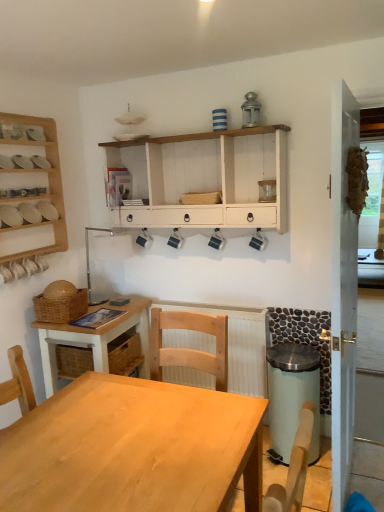
Question: Is white painted wood shelf at upper center, arranged as the 1th shelf when viewed from the right, at the right side of natural wood desk at left?

Choices:
 (A) yes
 (B) no

Answer: (A)

Question: Does white painted wood shelf at upper center, arranged as the 1th shelf when viewed from the right, turn towards natural wood desk at left?

Choices:
 (A) no
 (B) yes

Answer: (A)

Question: Is white painted wood shelf at upper center, the 2th shelf from the left, smaller than natural wood desk at left?

Choices:
 (A) no
 (B) yes

Answer: (B)

Question: From the image's perspective, does white painted wood shelf at upper center, the 2th shelf from the left, appear lower than natural wood desk at left?

Choices:
 (A) yes
 (B) no

Answer: (B)

Question: Is natural wood desk at left inside white painted wood shelf at upper center, the 2th shelf from the left?

Choices:
 (A) no
 (B) yes

Answer: (A)

Question: Is white painted wood shelf at upper center, the 2th shelf from the left, in front of or behind wooden shelf at left in the image?

Choices:
 (A) front
 (B) behind

Answer: (B)

Question: Is white painted wood shelf at upper center, the 2th shelf from the left, bigger or smaller than wooden shelf at left?

Choices:
 (A) small
 (B) big

Answer: (B)

Question: Choose the correct answer: Is white painted wood shelf at upper center, the 2th shelf from the left, inside wooden shelf at left or outside it?

Choices:
 (A) inside
 (B) outside

Answer: (B)

Question: Based on their positions, is white painted wood shelf at upper center, the 2th shelf from the left, located to the left or right of wooden shelf at left?

Choices:
 (A) left
 (B) right

Answer: (B)

Question: From a real-world perspective, relative to natural wood desk at left, is white matte bowls at upper left, the second shelf positioned from the right, vertically above or below?

Choices:
 (A) below
 (B) above

Answer: (B)

Question: In terms of height, does white matte bowls at upper left, the 1th shelf viewed from the left, look taller or shorter compared to natural wood desk at left?

Choices:
 (A) tall
 (B) short

Answer: (B)

Question: Looking at their shapes, would you say white matte bowls at upper left, the second shelf positioned from the right, is wider or thinner than natural wood desk at left?

Choices:
 (A) thin
 (B) wide

Answer: (A)

Question: Considering the positions of white matte bowls at upper left, the 1th shelf viewed from the left, and natural wood desk at left in the image, is white matte bowls at upper left, the 1th shelf viewed from the left, bigger or smaller than natural wood desk at left?

Choices:
 (A) big
 (B) small

Answer: (B)

Question: Is wooden screen door at right to the left or to the right of white painted wood shelf at upper center, arranged as the 1th shelf when viewed from the right, in the image?

Choices:
 (A) right
 (B) left

Answer: (A)

Question: Is wooden screen door at right bigger or smaller than white painted wood shelf at upper center, arranged as the 1th shelf when viewed from the right?

Choices:
 (A) small
 (B) big

Answer: (B)